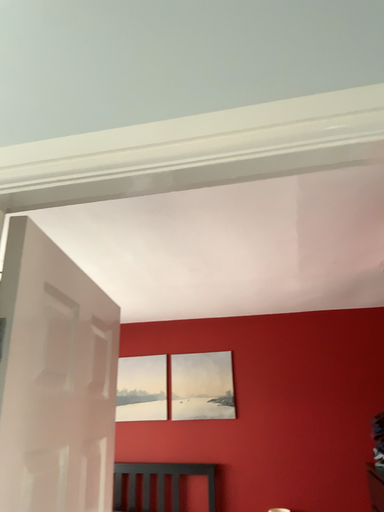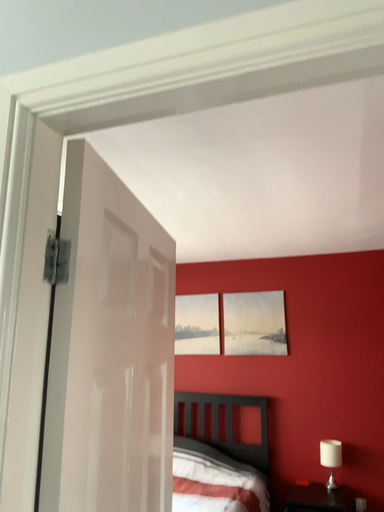
Question: Which way did the camera rotate in the video?

Choices:
 (A) rotated upward
 (B) rotated downward

Answer: (B)